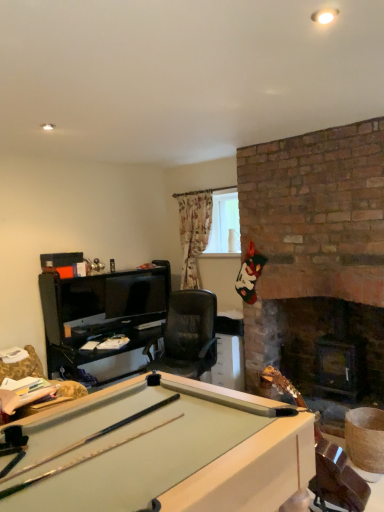
Question: Is black leather swivel chair at lower left spatially inside clear glass window at upper center, or outside of it?

Choices:
 (A) inside
 (B) outside

Answer: (B)

Question: In the image, is black leather swivel chair at lower left positioned in front of or behind clear glass window at upper center?

Choices:
 (A) behind
 (B) front

Answer: (B)

Question: Considering the real-world distances, which object is farthest from the wooden cue stick at lower right?

Choices:
 (A) clear glass window at upper center
 (B) black leather swivel chair at lower left

Answer: (A)

Question: Which object is positioned closest to the wooden cue stick at lower right?

Choices:
 (A) black leather swivel chair at lower left
 (B) clear glass window at upper center

Answer: (A)